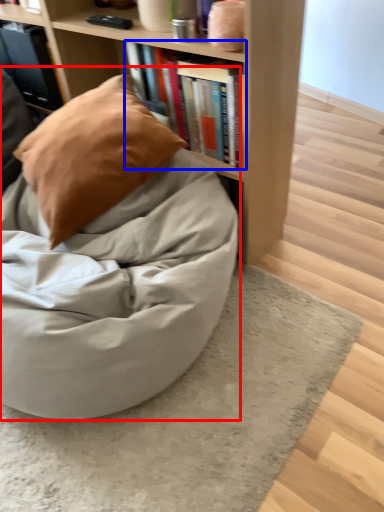
Question: Among these objects, which one is farthest to the camera, bean bag chair (highlighted by a red box) or book (highlighted by a blue box)?

Choices:
 (A) bean bag chair
 (B) book

Answer: (B)